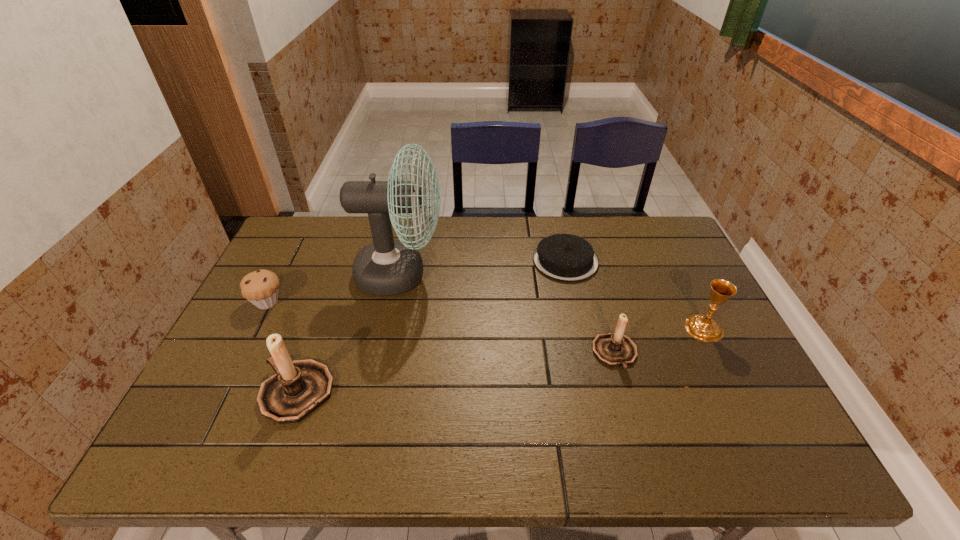
At what (x,y) coordinates should I click in order to perform the action: click on the second tallest object. Please return your answer as a coordinate pair (x, y). The image size is (960, 540). Looking at the image, I should click on (299, 387).

At what (x,y) coordinates should I click in order to perform the action: click on the left candle holder. Please return your answer as a coordinate pair (x, y). This screenshot has height=540, width=960. Looking at the image, I should click on (299, 387).

Identify the location of the shorter candle holder. (613, 349).

The height and width of the screenshot is (540, 960). I want to click on fan, so click(386, 267).

At what (x,y) coordinates should I click in order to perform the action: click on the leftmost object. Please return your answer as a coordinate pair (x, y). The width and height of the screenshot is (960, 540). Looking at the image, I should click on click(x=260, y=287).

Find the location of a particular element. This screenshot has height=540, width=960. muffin is located at coordinates (260, 287).

Image resolution: width=960 pixels, height=540 pixels. I want to click on the shortest object, so click(562, 257).

You are a GUI agent. You are given a task and a screenshot of the screen. Output one action in this format:
    pyautogui.click(x=<x>, y=<y>)
    Task: Click on the rightmost object
    
    Given the screenshot: What is the action you would take?
    pyautogui.click(x=704, y=328)

Where is `free location located 0.160m on the back of the taller candle holder`? free location located 0.160m on the back of the taller candle holder is located at coordinates (324, 317).

In order to click on vacant area situated on the right of the shorter candle holder in this screenshot , I will do `click(723, 354)`.